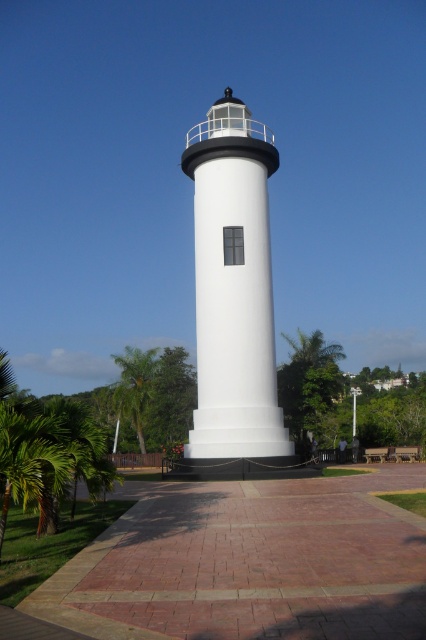
Question: Is brick paved walkway at center positioned behind white matte/lightweight tower at center?

Choices:
 (A) yes
 (B) no

Answer: (B)

Question: Which point is closer to the camera taking this photo?

Choices:
 (A) (190, 177)
 (B) (140, 442)

Answer: (A)

Question: Which object is farther from the camera taking this photo?

Choices:
 (A) brick paved walkway at center
 (B) white matte/lightweight tower at center
 (C) green leafy palm tree at lower left

Answer: (C)

Question: In this image, where is brick paved walkway at center located relative to white matte/lightweight tower at center?

Choices:
 (A) left
 (B) right

Answer: (B)

Question: Can you confirm if white matte/lightweight tower at center is positioned to the right of green leafy palm tree at lower left?

Choices:
 (A) yes
 (B) no

Answer: (A)

Question: Among these objects, which one is nearest to the camera?

Choices:
 (A) green leafy palm tree at lower left
 (B) brick paved walkway at center

Answer: (B)